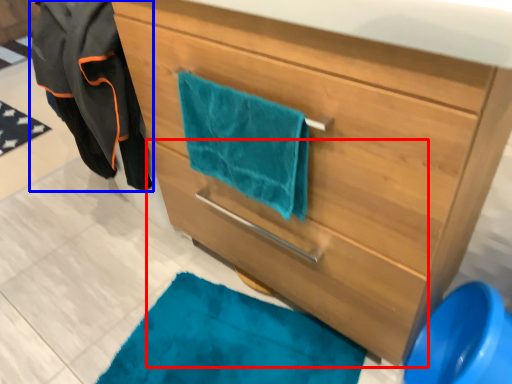
Question: Which of the following is the closest to the observer, drawer (highlighted by a red box) or jacket (highlighted by a blue box)?

Choices:
 (A) drawer
 (B) jacket

Answer: (A)